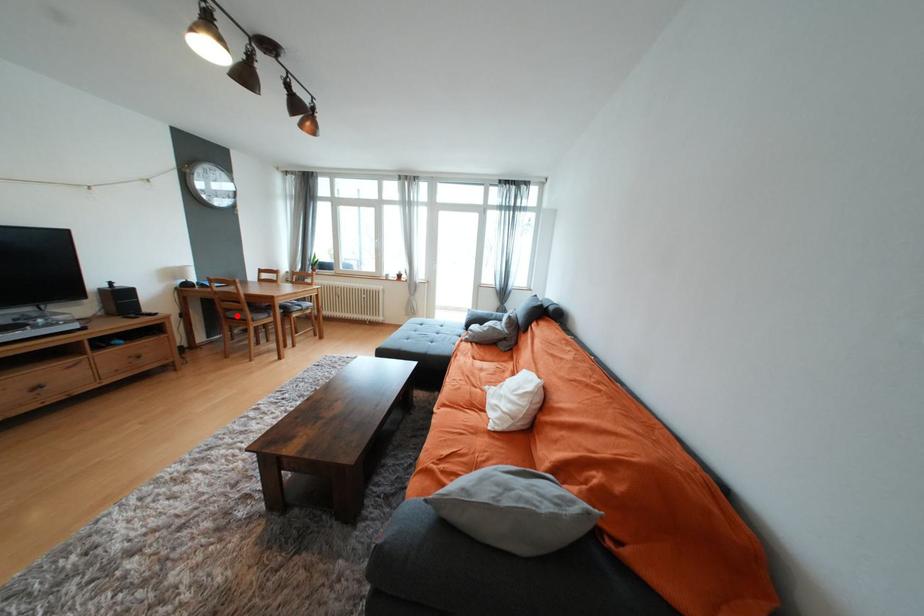
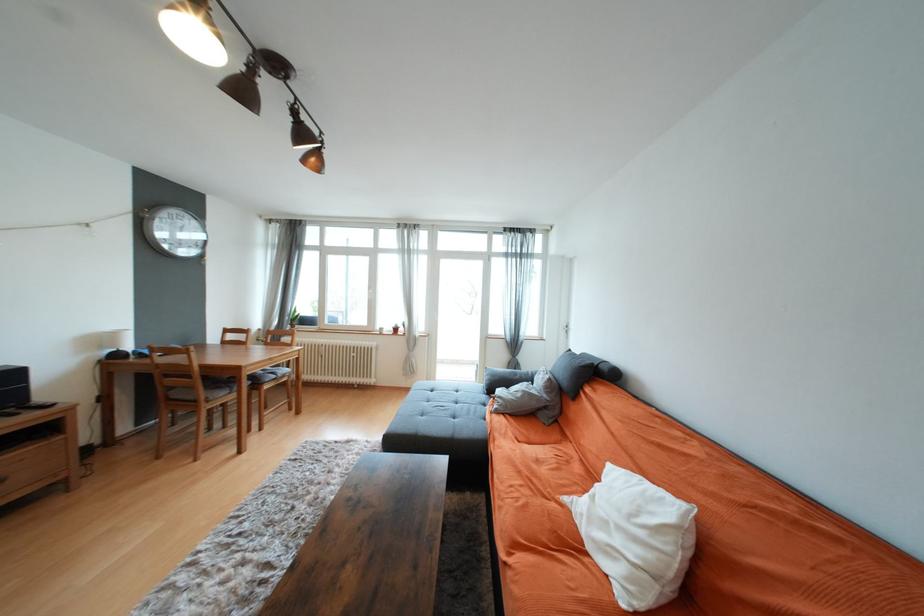
The point at the highlighted location is marked in the first image. Where is the corresponding point in the second image?

(181, 395)